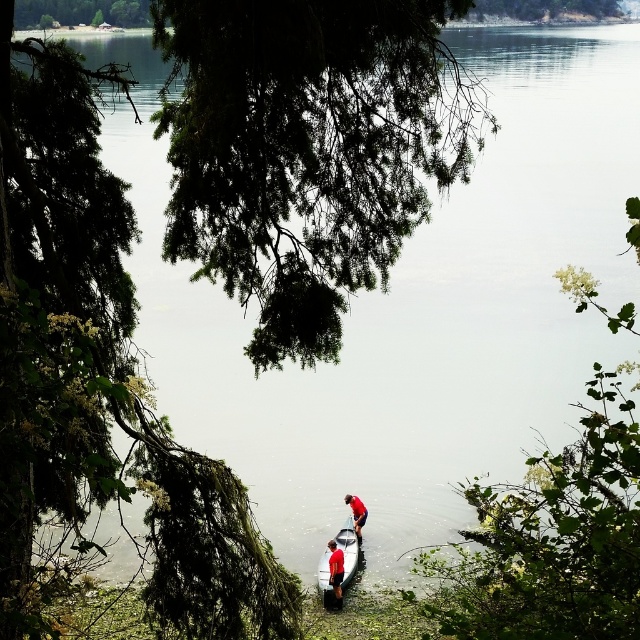
Question: Which of the following is the farthest from the observer?

Choices:
 (A) (545, 461)
 (B) (342, 566)

Answer: (B)

Question: Considering the relative positions of green textured tree at upper left and white glossy canoe at center in the image provided, where is green textured tree at upper left located with respect to white glossy canoe at center?

Choices:
 (A) right
 (B) left

Answer: (B)

Question: Does green leafy tree at lower right have a smaller size compared to green textured tree at upper left?

Choices:
 (A) yes
 (B) no

Answer: (A)

Question: Is green textured leaves at upper center below red fabric shirt at center?

Choices:
 (A) yes
 (B) no

Answer: (B)

Question: Which of the following is the closest to the observer?

Choices:
 (A) green textured tree at upper left
 (B) green leafy tree at lower right
 (C) red fabric shirt at lower center

Answer: (B)

Question: Which of the following is the closest to the observer?

Choices:
 (A) (596, 465)
 (B) (362, 509)

Answer: (A)